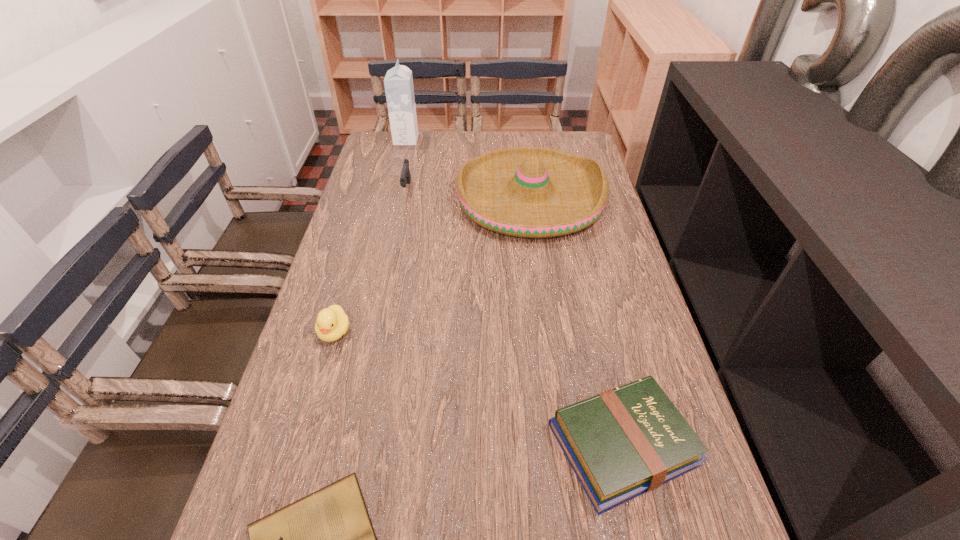
Locate an element on the screen. This screenshot has width=960, height=540. object that is the fourth closest to the shorter book is located at coordinates (405, 178).

Find the location of a particular element. The height and width of the screenshot is (540, 960). object that is the third closest to the fourth farthest object is located at coordinates (621, 443).

I want to click on vacant space that satisfies the following two spatial constraints: 1. on the back side of the sombrero; 2. on the front label of the farthest object, so click(x=522, y=140).

The image size is (960, 540). Identify the location of free space that satisfies the following two spatial constraints: 1. on the front side of the second tallest object; 2. on the right side of the right book. (564, 444).

Identify the location of vacant space that satisfies the following two spatial constraints: 1. at the barrel of the sombrero; 2. on the left side of the pistol. The width and height of the screenshot is (960, 540). (405, 198).

Identify the location of vacant position in the image that satisfies the following two spatial constraints: 1. on the beak of the duckling; 2. on the right side of the taller book. (301, 444).